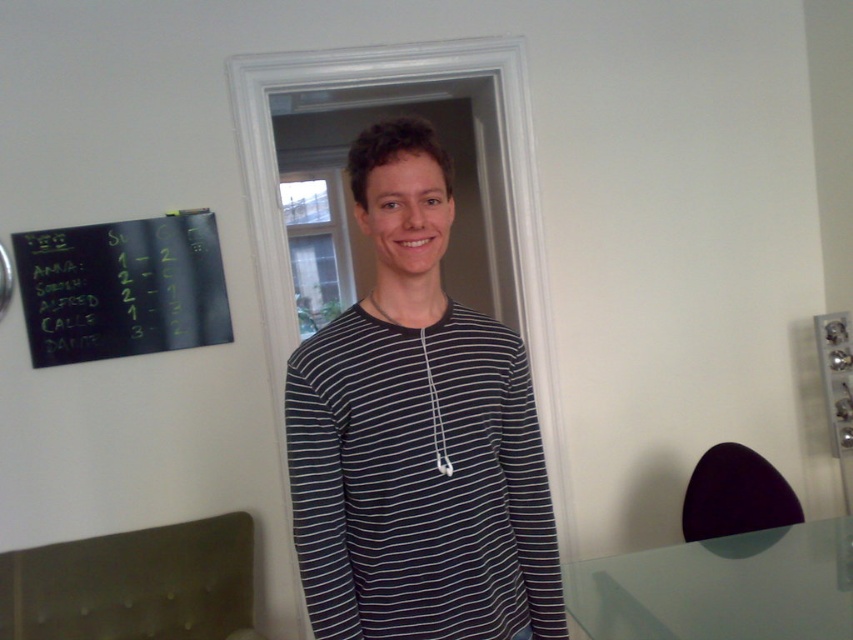
Question: Estimate the real-world distances between objects in this image. Which object is farther from the transparent glass table at lower right?

Choices:
 (A) black striped shirt at center
 (B) black chalkboard at upper left

Answer: (B)

Question: Among these objects, which one is farthest from the camera?

Choices:
 (A) transparent glass table at lower right
 (B) black striped shirt at center

Answer: (A)

Question: Considering the real-world distances, which object is closest to the black chalkboard at upper left?

Choices:
 (A) black striped shirt at center
 (B) transparent glass table at lower right

Answer: (A)

Question: Does black striped shirt at center appear over black chalkboard at upper left?

Choices:
 (A) no
 (B) yes

Answer: (A)

Question: Can you confirm if transparent glass table at lower right is smaller than black chalkboard at upper left?

Choices:
 (A) no
 (B) yes

Answer: (A)

Question: Does black striped shirt at center appear on the right side of black chalkboard at upper left?

Choices:
 (A) yes
 (B) no

Answer: (A)